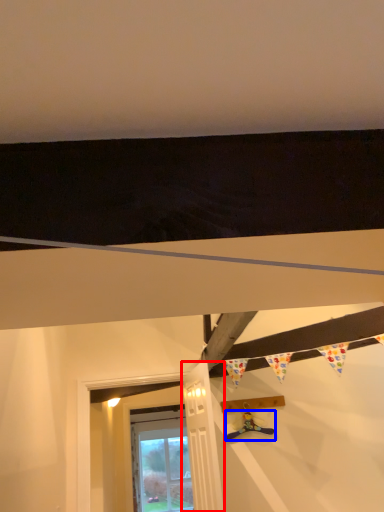
Question: Among these objects, which one is farthest to the camera, door (highlighted by a red box) or toy (highlighted by a blue box)?

Choices:
 (A) door
 (B) toy

Answer: (B)